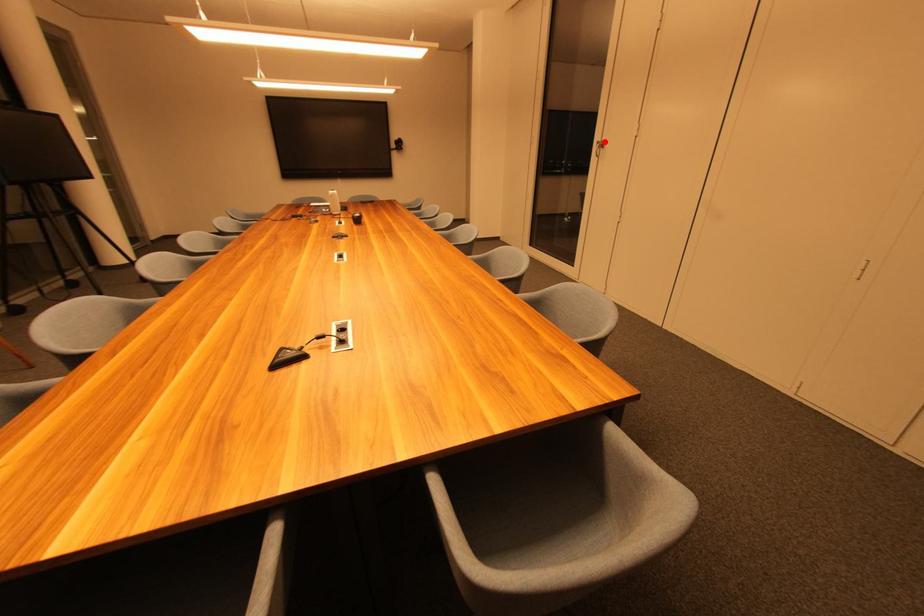
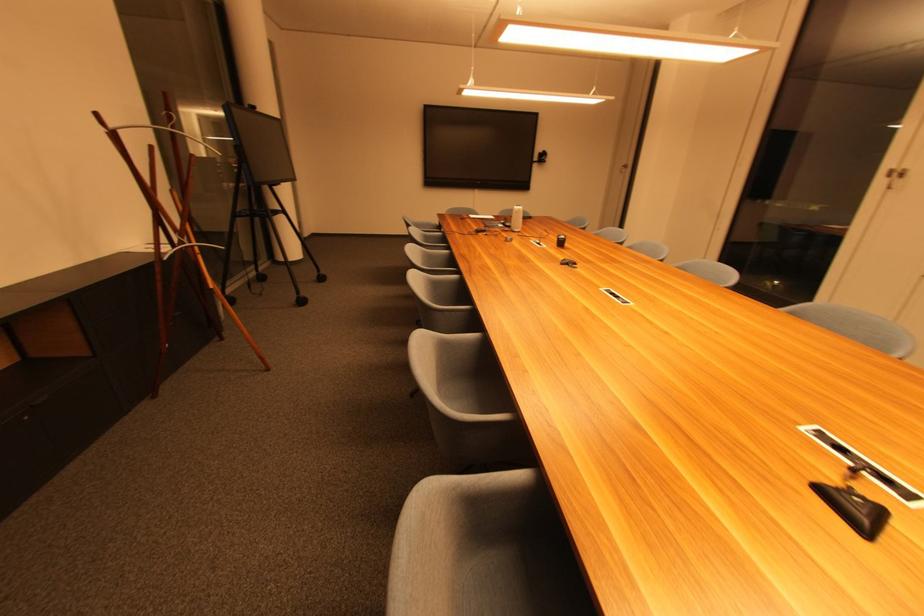
Find the pixel in the second image that matches the highlighted location in the first image.

(901, 169)